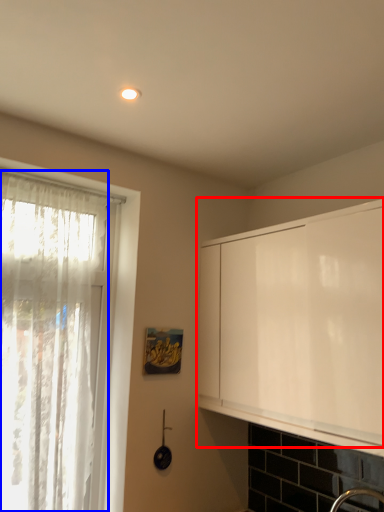
Question: Which point is further to the camera, cabinetry (highlighted by a red box) or curtain (highlighted by a blue box)?

Choices:
 (A) cabinetry
 (B) curtain

Answer: (B)